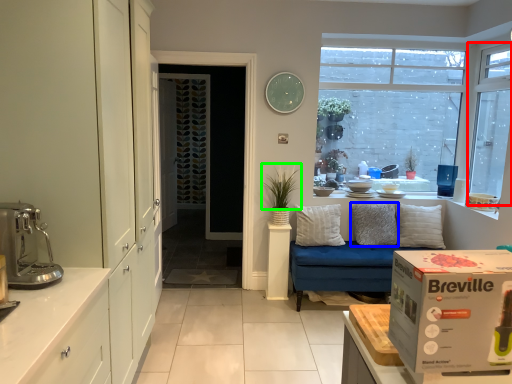
Question: Considering the real-world distances, which object is farthest from window (highlighted by a red box)? pillow (highlighted by a blue box) or plant (highlighted by a green box)?

Choices:
 (A) pillow
 (B) plant

Answer: (B)